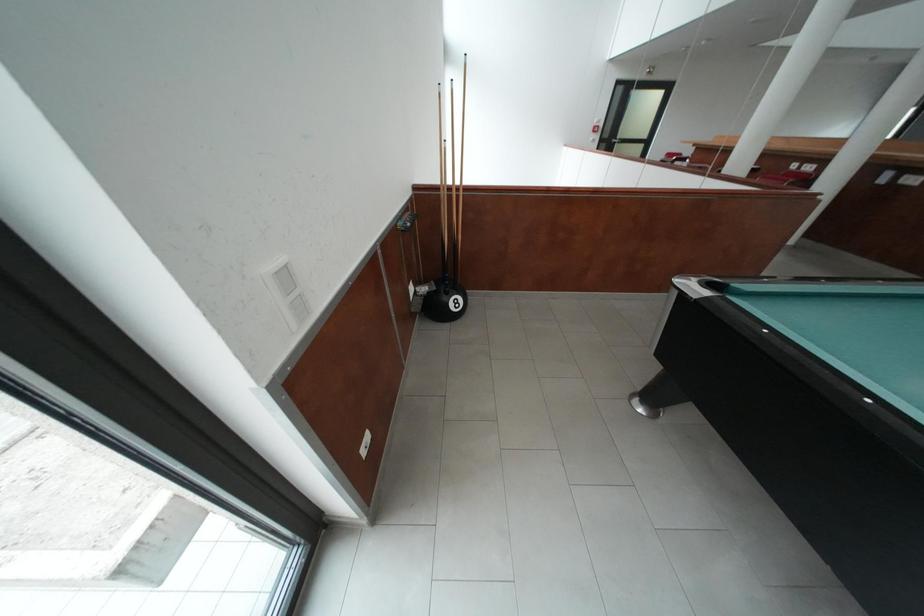
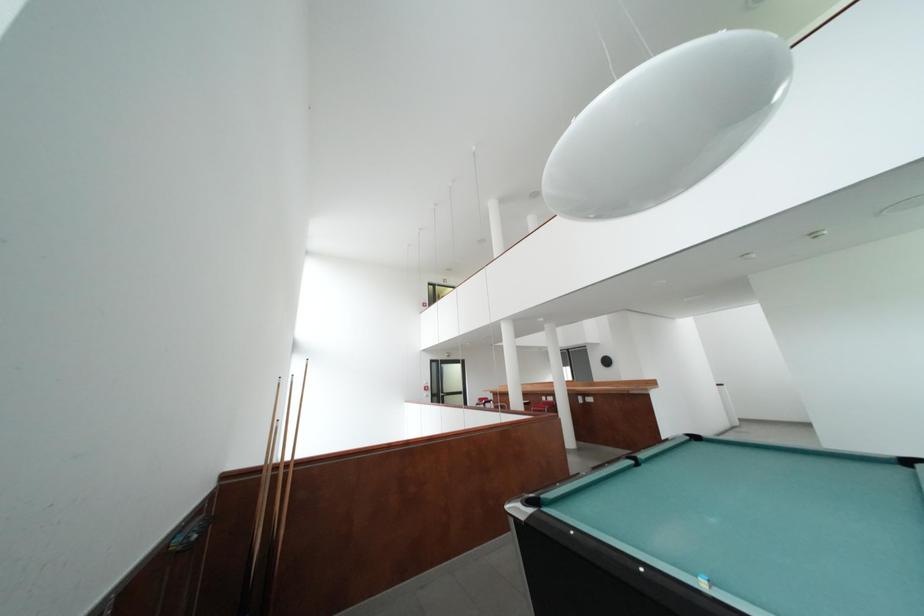
Looking at this image, first-person continuous shooting, in which direction is the camera rotating?

The camera rotated toward right-up.